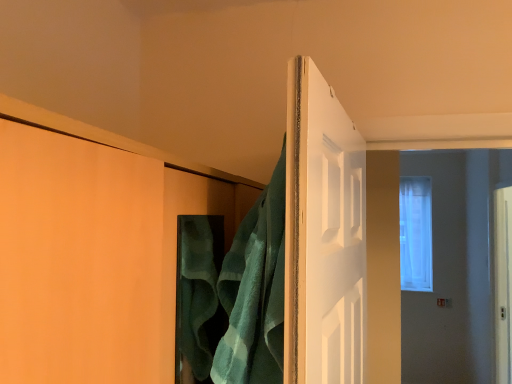
Question: Is translucent glass window at upper right not inside green terry cloth towel at center?

Choices:
 (A) yes
 (B) no

Answer: (A)

Question: From a real-world perspective, is translucent glass window at upper right located beneath green terry cloth towel at center?

Choices:
 (A) no
 (B) yes

Answer: (A)

Question: Would you say translucent glass window at upper right is a long distance from green terry cloth towel at center?

Choices:
 (A) yes
 (B) no

Answer: (A)

Question: Does translucent glass window at upper right have a greater width compared to green terry cloth towel at center?

Choices:
 (A) no
 (B) yes

Answer: (B)

Question: Is translucent glass window at upper right beside green terry cloth towel at center?

Choices:
 (A) no
 (B) yes

Answer: (A)

Question: Considering the relative sizes of translucent glass window at upper right and green terry cloth towel at center in the image provided, is translucent glass window at upper right shorter than green terry cloth towel at center?

Choices:
 (A) yes
 (B) no

Answer: (B)

Question: Can translucent glass window at upper right be found inside green terry cloth towel at center?

Choices:
 (A) yes
 (B) no

Answer: (B)

Question: Are green terry cloth towel at center and translucent glass window at upper right making contact?

Choices:
 (A) no
 (B) yes

Answer: (A)

Question: Considering the relative sizes of green terry cloth towel at center and translucent glass window at upper right in the image provided, is green terry cloth towel at center taller than translucent glass window at upper right?

Choices:
 (A) no
 (B) yes

Answer: (A)

Question: Considering the relative sizes of green terry cloth towel at center and translucent glass window at upper right in the image provided, is green terry cloth towel at center thinner than translucent glass window at upper right?

Choices:
 (A) no
 (B) yes

Answer: (B)

Question: Is green terry cloth towel at center positioned behind translucent glass window at upper right?

Choices:
 (A) yes
 (B) no

Answer: (B)

Question: Does green terry cloth towel at center appear on the left side of translucent glass window at upper right?

Choices:
 (A) no
 (B) yes

Answer: (B)

Question: In the image, is translucent glass window at upper right positioned in front of or behind green terry cloth towel at center?

Choices:
 (A) front
 (B) behind

Answer: (B)